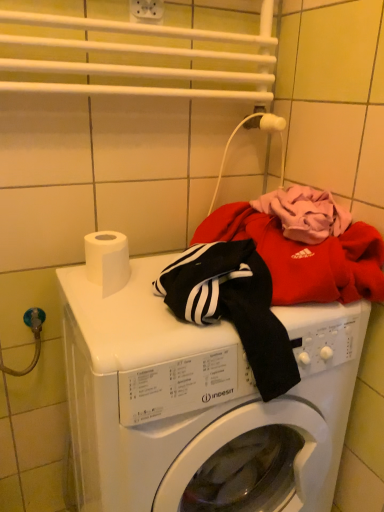
Question: Considering the positions of white plastic electric outlet at upper center and white glossy washing machine at center in the image, is white plastic electric outlet at upper center wider or thinner than white glossy washing machine at center?

Choices:
 (A) wide
 (B) thin

Answer: (B)

Question: From the image's perspective, relative to white glossy washing machine at center, is white plastic electric outlet at upper center above or below?

Choices:
 (A) above
 (B) below

Answer: (A)

Question: Estimate the real-world distances between objects in this image. Which object is closer to the white plastic electric outlet at upper center?

Choices:
 (A) white glossy washing machine at center
 (B) white matte toilet paper at top left

Answer: (B)

Question: Which is nearer to the white glossy washing machine at center?

Choices:
 (A) white plastic electric outlet at upper center
 (B) white matte toilet paper at top left

Answer: (B)